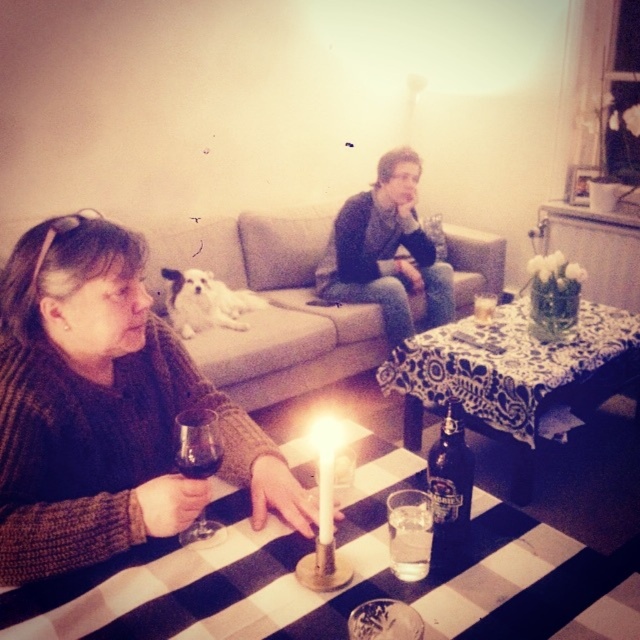
Question: Which object is farther from the camera taking this photo?

Choices:
 (A) white wax candle at center
 (B) white lace tablecloth at center

Answer: (B)

Question: Is dark blue sweater at center above white fluffy dog at center?

Choices:
 (A) yes
 (B) no

Answer: (A)

Question: Does translucent glass bottle at center have a smaller size compared to transparent glass at lower left?

Choices:
 (A) yes
 (B) no

Answer: (B)

Question: Can you confirm if white fluffy dog at center is positioned to the left of white wax candle at center?

Choices:
 (A) yes
 (B) no

Answer: (A)

Question: Which object is farther from the camera taking this photo?

Choices:
 (A) dark blue sweater at center
 (B) knitted sweater at lower left

Answer: (A)

Question: Which of the following is the closest to the observer?

Choices:
 (A) translucent glass wine at table center
 (B) white lace tablecloth at center
 (C) translucent glass bottle at center
 (D) black checkered tablecloth at lower center

Answer: (D)